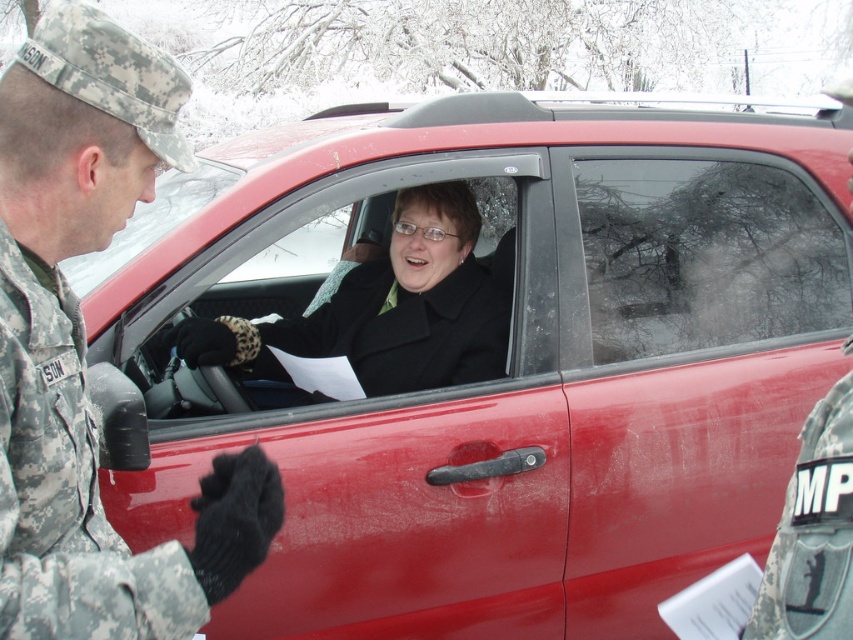
Who is taller, camouflage uniform at left or camouflage fabric uniform at left?

camouflage uniform at left is taller.

Between camouflage uniform at left and camouflage fabric uniform at left, which one appears on the right side from the viewer's perspective?

From the viewer's perspective, camouflage uniform at left appears more on the right side.

This screenshot has width=853, height=640. What do you see at coordinates (85, 348) in the screenshot?
I see `camouflage uniform at left` at bounding box center [85, 348].

What are the coordinates of `camouflage uniform at left` in the screenshot? It's located at (85, 348).

Who is positioned more to the right, camouflage uniform at left or black wool coat at center?

From the viewer's perspective, black wool coat at center appears more on the right side.

Is camouflage uniform at left thinner than black wool coat at center?

Yes, camouflage uniform at left is thinner than black wool coat at center.

Where is `camouflage uniform at left`? This screenshot has height=640, width=853. camouflage uniform at left is located at coordinates (85, 348).

Between point (132, 579) and point (828, 611), which one is positioned behind?

The point (132, 579) is behind.

The width and height of the screenshot is (853, 640). Identify the location of camouflage uniform at left. pos(85,348).

In order to click on camouflage uniform at left in this screenshot , I will do `click(85, 348)`.